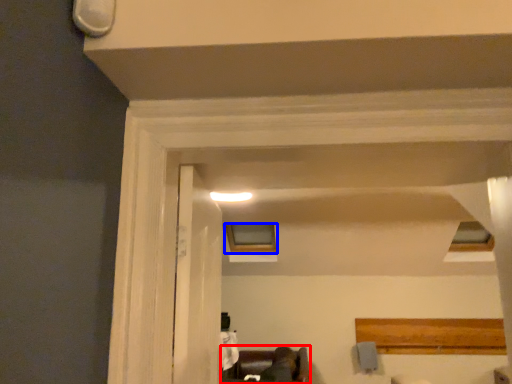
Question: Which object is closer to the camera taking this photo, furniture (highlighted by a red box) or window (highlighted by a blue box)?

Choices:
 (A) furniture
 (B) window

Answer: (A)